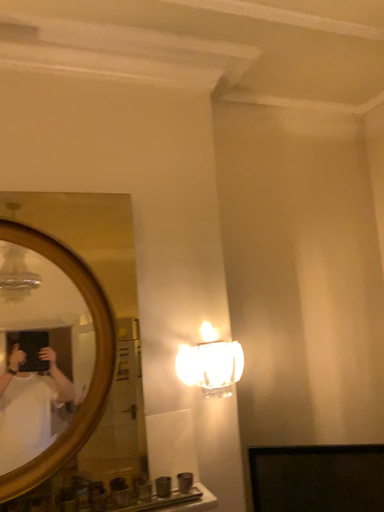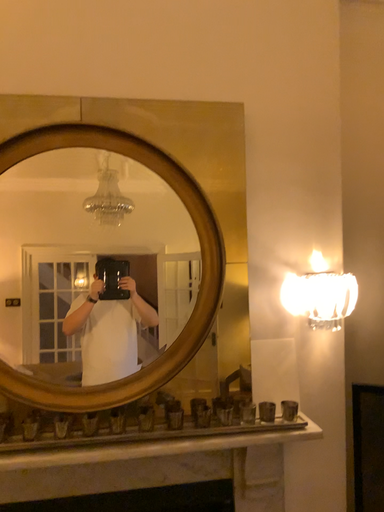
Question: Which way did the camera rotate in the video?

Choices:
 (A) rotated downward
 (B) rotated upward

Answer: (A)